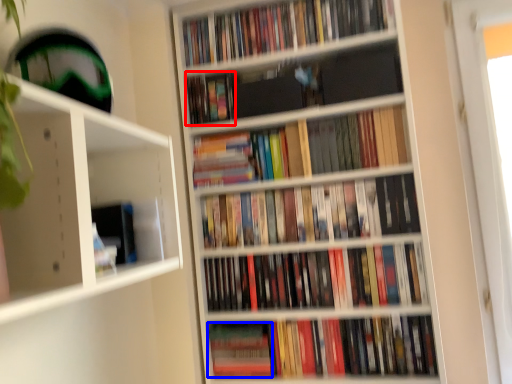
Question: Which object is closer to the camera taking this photo, book (highlighted by a red box) or paperback book (highlighted by a blue box)?

Choices:
 (A) book
 (B) paperback book

Answer: (B)